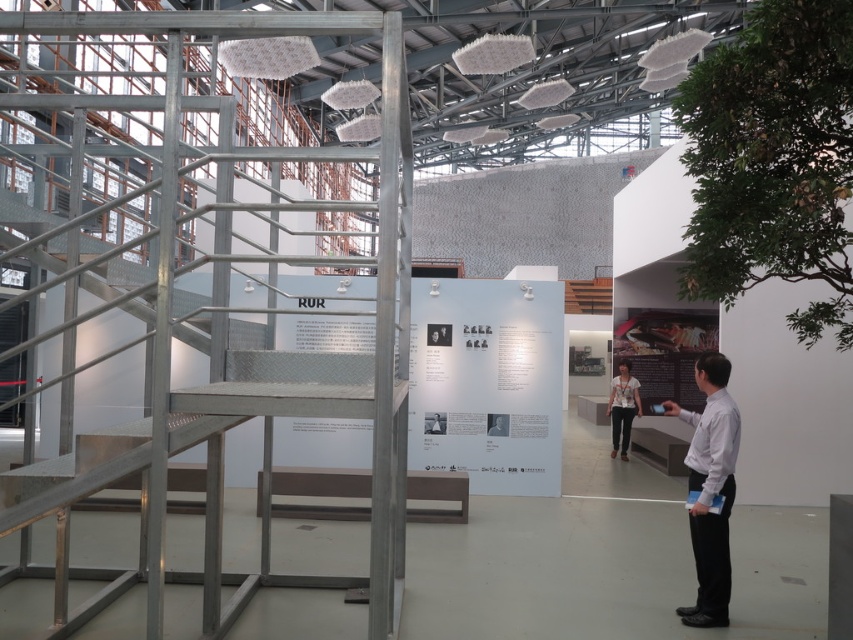
Is white printed shirt at center shorter than wooden stairs at center?

In fact, white printed shirt at center may be taller than wooden stairs at center.

Who is more distant from viewer, (614, 451) or (569, 298)?

The point (569, 298) is more distant.

The image size is (853, 640). What do you see at coordinates (622, 406) in the screenshot? I see `white printed shirt at center` at bounding box center [622, 406].

The width and height of the screenshot is (853, 640). I want to click on white printed shirt at center, so click(x=622, y=406).

Who is shorter, white shirt at right or white printed shirt at center?

white printed shirt at center

From the picture: Can you confirm if white shirt at right is thinner than white printed shirt at center?

Yes.

Identify the location of white shirt at right. This screenshot has width=853, height=640. (711, 488).

I want to click on white shirt at right, so click(711, 488).

Is white shirt at right positioned before wooden stairs at center?

Yes, it is in front of wooden stairs at center.

The image size is (853, 640). What do you see at coordinates (711, 488) in the screenshot?
I see `white shirt at right` at bounding box center [711, 488].

Describe the element at coordinates (711, 488) in the screenshot. I see `white shirt at right` at that location.

Locate an element on the screen. white shirt at right is located at coordinates (711, 488).